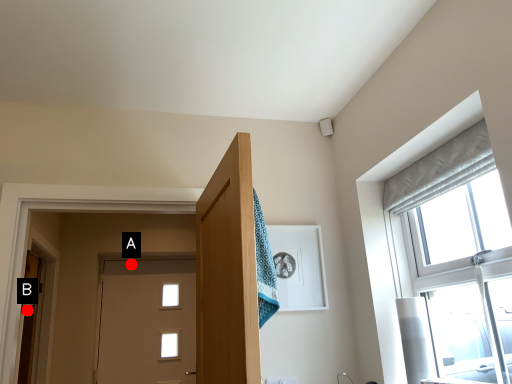
Question: Two points are circled on the image, labeled by A and B beside each circle. Which of the following is the closest to the observer?

Choices:
 (A) A is closer
 (B) B is closer

Answer: (B)